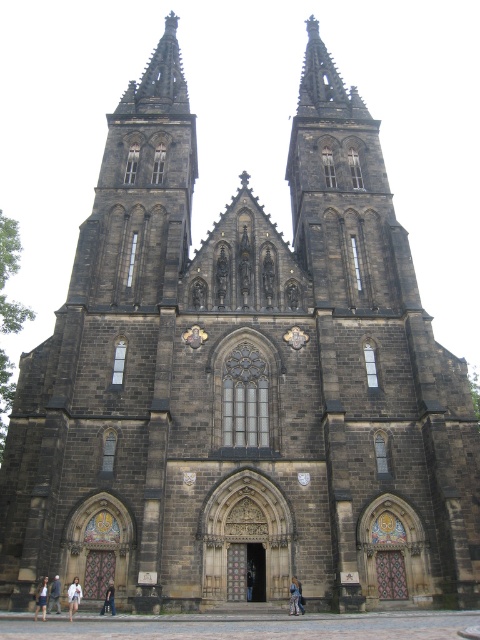
You are standing in front of the grand Gothic church and see the blue denim jeans at lower center. Where exactly are the blue denim jeans located in relation to the church?

The blue denim jeans at lower center are located at point (295, 596) in relation to the church.

Based on the photo, you are standing in front of the grand Gothic church and notice two pieces of clothing on the ground. The denim shorts at lower center and the light blue denim jeans at lower left. Which piece of clothing is shorter in height?

The denim shorts at lower center is not as tall as the light blue denim jeans at lower left, so the denim shorts at lower center is shorter in height.